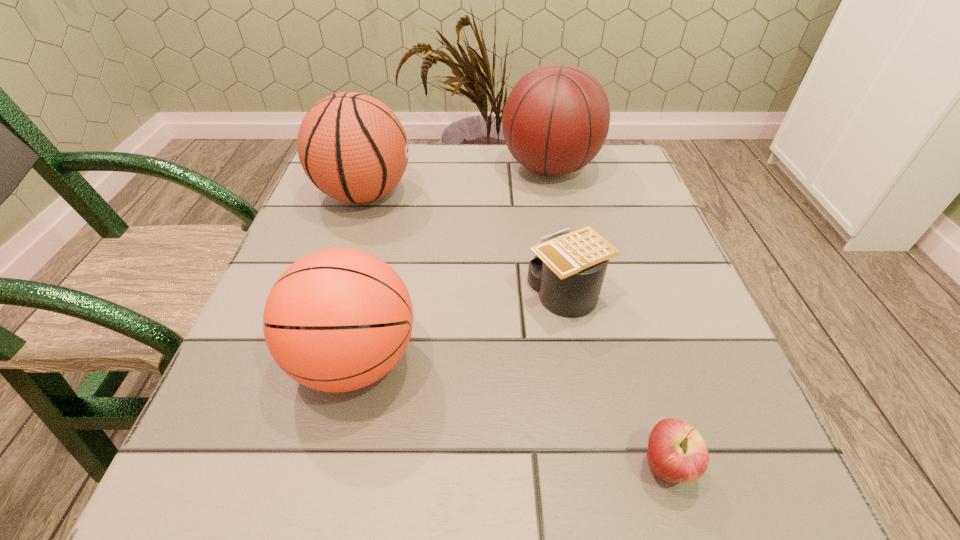
Find the location of `calculator present at the right edge`. calculator present at the right edge is located at coordinates (568, 270).

Where is `apple at the right edge`? apple at the right edge is located at coordinates (677, 452).

Identify the location of object present at the far left corner. (352, 147).

Identify the location of object at the far right corner. (556, 119).

Find the location of a particular element. object located in the near right corner section of the desktop is located at coordinates (677, 452).

Where is `free space at the far edge`? This screenshot has height=540, width=960. free space at the far edge is located at coordinates (548, 188).

Image resolution: width=960 pixels, height=540 pixels. Identify the location of free space at the near edge of the desktop. (589, 496).

In the image, there is a desktop. Where is `vacant space at the left edge`? This screenshot has width=960, height=540. vacant space at the left edge is located at coordinates (273, 414).

Find the location of a particular element. This screenshot has width=960, height=540. free region at the right edge of the desktop is located at coordinates (596, 221).

In the image, there is a desktop. Find the location of `free region at the near left corner`. free region at the near left corner is located at coordinates point(273,501).